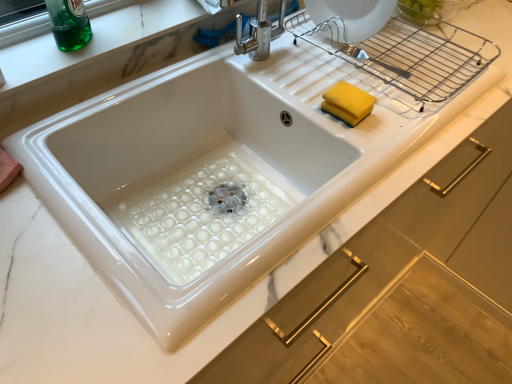
You are a GUI agent. You are given a task and a screenshot of the screen. Output one action in this format:
    pyautogui.click(x=<x>, y=<y>)
    Task: Click on the free space in front of green glass bottle at upper left
    Image resolution: width=512 pixels, height=384 pixels.
    Given the screenshot: What is the action you would take?
    pyautogui.click(x=47, y=60)